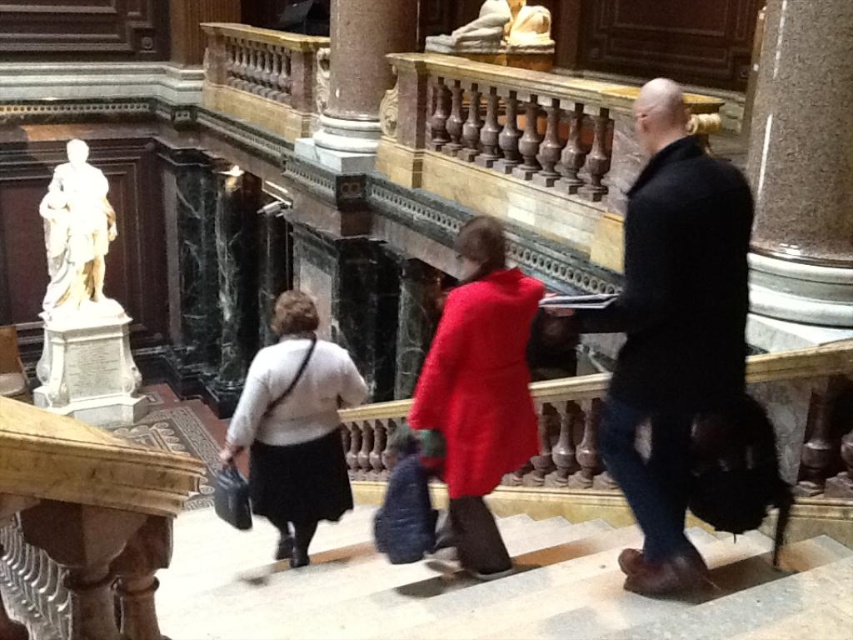
Consider the image. Which is more to the left, dark brown leather coat at center or white sweater at center?

From the viewer's perspective, white sweater at center appears more on the left side.

Does dark brown leather coat at center appear under white sweater at center?

No.

Is point (712, 230) behind point (259, 509)?

No, (712, 230) is closer to viewer.

In order to click on dark brown leather coat at center in this screenshot , I will do `click(670, 330)`.

Does point (514, 412) lie in front of point (44, 323)?

Yes, point (514, 412) is closer to viewer.

Does velvet red coat at center have a lesser width compared to white marble statue at left?

Indeed, velvet red coat at center has a lesser width compared to white marble statue at left.

Between point (521, 356) and point (68, 394), which one is positioned behind?

Positioned behind is point (68, 394).

You are a GUI agent. You are given a task and a screenshot of the screen. Output one action in this format:
    pyautogui.click(x=<x>, y=<y>)
    Task: Click on the velvet red coat at center
    
    Given the screenshot: What is the action you would take?
    pyautogui.click(x=479, y=388)

Between dark brown leather coat at center and white marble statue at left, which one appears on the left side from the viewer's perspective?

white marble statue at left is more to the left.

Is point (672, 259) positioned in front of point (78, 358)?

Yes.

What do you see at coordinates (670, 330) in the screenshot?
I see `dark brown leather coat at center` at bounding box center [670, 330].

Where is `dark brown leather coat at center`? This screenshot has height=640, width=853. dark brown leather coat at center is located at coordinates click(670, 330).